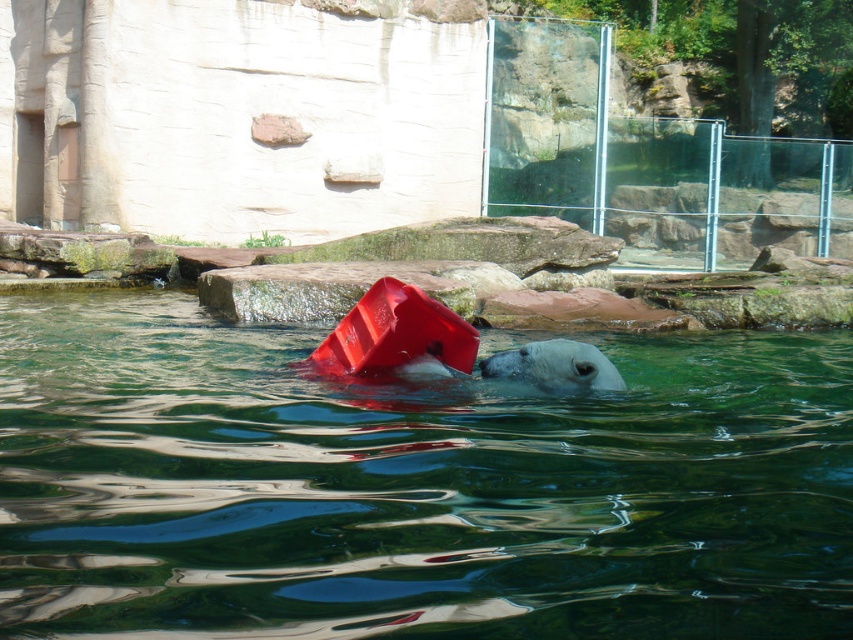
You are a zookeeper observing the polar bear enclosure. You notice the white matte bear at center and the smooth plastic pool at center. Which object is positioned lower in the enclosure?

The smooth plastic pool at center is positioned lower than the white matte bear at center, as it is located below the bear.

You are a zookeeper planning to place a new feeding station in the polar bear enclosure. The smooth plastic pool at center is located at coordinates 0.761, 0.484. Where should you position the feeding station to ensure it is not submerged when the water level rises? Please provide coordinates based on the image grid system.

The feeding station should be positioned above the water level. Since the smooth plastic pool at center is submerged and located at (x=412, y=486), placing the feeding station at a higher elevation, such as on the rocky structure or the sloped area mentioned in the scene, would keep it dry. Specific coordinates depend on the terrain, but avoiding the pool area ensures it stays above water.

You are a zookeeper preparing to place a new enrichment item in the enclosure. The item is 1.2 meters in diameter. You have two options for placement locations based on the image. The first location is near the smooth plastic pool at center, and the second is near the white matte bear at center. Which location would allow the item to fit without overlapping the existing objects?

The smooth plastic pool at center is smaller than the white matte bear at center. The item with 1.2 meters diameter would fit better near the white matte bear at center since it is larger and has more space available compared to the smaller smooth plastic pool at center.